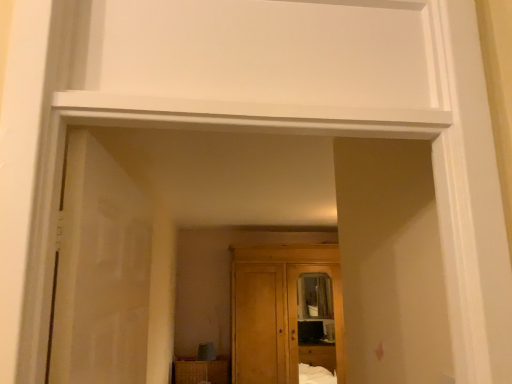
Question: From a real-world perspective, is wooden cupboard at center over translucent glass door at left?

Choices:
 (A) no
 (B) yes

Answer: (A)

Question: Is there a large distance between wooden cupboard at center and translucent glass door at left?

Choices:
 (A) no
 (B) yes

Answer: (B)

Question: Is the position of wooden cupboard at center more distant than that of translucent glass door at left?

Choices:
 (A) no
 (B) yes

Answer: (B)

Question: Is wooden cupboard at center surrounding translucent glass door at left?

Choices:
 (A) yes
 (B) no

Answer: (B)

Question: Is wooden cupboard at center bigger than translucent glass door at left?

Choices:
 (A) yes
 (B) no

Answer: (A)

Question: Considering the relative sizes of wooden cupboard at center and translucent glass door at left in the image provided, is wooden cupboard at center wider than translucent glass door at left?

Choices:
 (A) no
 (B) yes

Answer: (B)

Question: Considering the relative positions of wooden cabinet at lower center and wooden cupboard at center in the image provided, is wooden cabinet at lower center to the left of wooden cupboard at center from the viewer's perspective?

Choices:
 (A) yes
 (B) no

Answer: (A)

Question: Is wooden cupboard at center inside wooden cabinet at lower center?

Choices:
 (A) yes
 (B) no

Answer: (B)

Question: Can you confirm if wooden cabinet at lower center is positioned to the right of wooden cupboard at center?

Choices:
 (A) yes
 (B) no

Answer: (B)

Question: Is wooden cabinet at lower center facing away from wooden cupboard at center?

Choices:
 (A) no
 (B) yes

Answer: (A)

Question: From the image's perspective, is wooden cabinet at lower center beneath wooden cupboard at center?

Choices:
 (A) yes
 (B) no

Answer: (A)

Question: From a real-world perspective, is wooden cabinet at lower center over wooden cupboard at center?

Choices:
 (A) no
 (B) yes

Answer: (A)

Question: From the image's perspective, is translucent glass door at left beneath wooden cabinet at lower center?

Choices:
 (A) yes
 (B) no

Answer: (B)